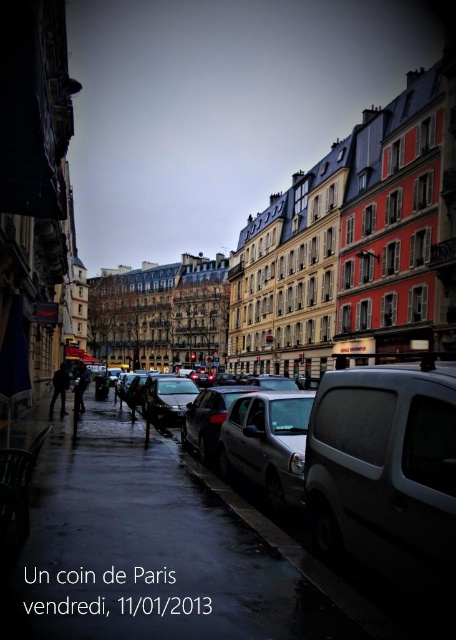
You are a fashion designer observing two dark gray jackets in the Paris street scene. The jackets are labeled as dark gray jacket at left and dark gray jacket at center. Which jacket appears shorter in height?

The dark gray jacket at left has a lesser height compared to the dark gray jacket at center, so the dark gray jacket at left appears shorter in height.

You are a delivery person standing on the wet asphalt sidewalk at lower left, and you need to deliver a package to the shiny silver car at center. Can you walk directly to the car without stepping off the sidewalk?

The wet asphalt sidewalk at lower left is in front of the shiny silver car at center, so you can walk directly to the car without leaving the sidewalk.

You are a delivery person who needs to park your satin black car at center on the wet asphalt sidewalk at lower left. Considering the size of both, will the car fit entirely on the sidewalk?

The wet asphalt sidewalk at lower left is larger in size than the satin black car at center, so the car will fit entirely on the sidewalk.